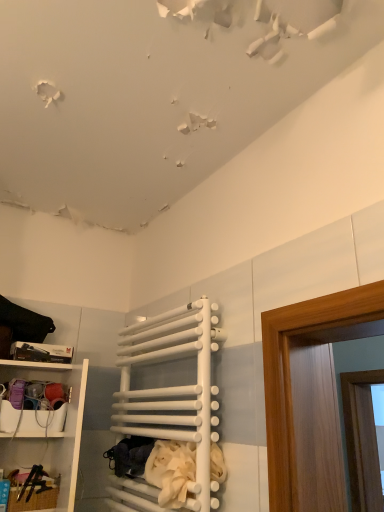
Image resolution: width=384 pixels, height=512 pixels. I want to click on white matte towel rack at center, so click(x=170, y=414).

Which object is further away from the camera taking this photo, beige fabric laundry at lower center or white matte towel rack at center?

beige fabric laundry at lower center is further away from the camera.

From the image's perspective, is beige fabric laundry at lower center over white matte towel rack at center?

No, from the image's perspective, beige fabric laundry at lower center is not on top of white matte towel rack at center.

Between point (167, 458) and point (191, 336), which one is positioned in front?

Point (167, 458)

Is beige fabric laundry at lower center to the right of white plastic shelf at lower left from the viewer's perspective?

Correct, you'll find beige fabric laundry at lower center to the right of white plastic shelf at lower left.

From the picture: From the image's perspective, is beige fabric laundry at lower center under white plastic shelf at lower left?

No.

Is beige fabric laundry at lower center looking in the opposite direction of white plastic shelf at lower left?

No.

This screenshot has width=384, height=512. I want to click on cabinet on the right side of white plastic shelf at lower left, so click(170, 414).

Does white matte towel rack at center come behind white plastic shelf at lower left?

No, white matte towel rack at center is closer to the viewer.

Does white matte towel rack at center have a smaller size compared to white plastic shelf at lower left?

Correct, white matte towel rack at center occupies less space than white plastic shelf at lower left.

Would you say white matte towel rack at center is inside or outside white plastic shelf at lower left?

white matte towel rack at center is spatially situated outside white plastic shelf at lower left.

Which object is thinner, white matte towel rack at center or beige fabric laundry at lower center?

white matte towel rack at center is thinner.

From the image's perspective, is white matte towel rack at center on beige fabric laundry at lower center?

Yes, from the image's perspective, white matte towel rack at center is on top of beige fabric laundry at lower center.

Is the surface of white plastic shelf at lower left in direct contact with beige fabric laundry at lower center?

No, white plastic shelf at lower left is not touching beige fabric laundry at lower center.

Is white plastic shelf at lower left bigger or smaller than beige fabric laundry at lower center?

Considering their sizes, white plastic shelf at lower left takes up more space than beige fabric laundry at lower center.

In order to click on laundry above the white plastic shelf at lower left (from the image's perspective) in this screenshot , I will do `click(164, 468)`.

From the image's perspective, is white plastic shelf at lower left below beige fabric laundry at lower center?

Yes, from the image's perspective, white plastic shelf at lower left is beneath beige fabric laundry at lower center.

In the scene shown: Which is more to the left, white plastic shelf at lower left or white matte towel rack at center?

white plastic shelf at lower left.

You are a GUI agent. You are given a task and a screenshot of the screen. Output one action in this format:
    pyautogui.click(x=<x>, y=<y>)
    Task: Click on the cabinet that is above the white plastic shelf at lower left (from the image's perspective)
    The width and height of the screenshot is (384, 512).
    Given the screenshot: What is the action you would take?
    pyautogui.click(x=170, y=414)

Does point (18, 462) lie in front of point (170, 436)?

No, it is behind (170, 436).

Is white plastic shelf at lower left in contact with white matte towel rack at center?

No, white plastic shelf at lower left is not in contact with white matte towel rack at center.

What are the coordinates of `laundry behind the white matte towel rack at center` in the screenshot? It's located at (164, 468).

I want to click on shelf below the beige fabric laundry at lower center (from the image's perspective), so click(x=49, y=432).

Looking at the image, which one is located further to white matte towel rack at center, white plastic shelf at lower left or beige fabric laundry at lower center?

white plastic shelf at lower left is positioned further to the anchor white matte towel rack at center.

Based on their spatial positions, is white matte towel rack at center or white plastic shelf at lower left further from beige fabric laundry at lower center?

The object further to beige fabric laundry at lower center is white plastic shelf at lower left.

Estimate the real-world distances between objects in this image. Which object is further from beige fabric laundry at lower center, white plastic shelf at lower left or white matte towel rack at center?

Among the two, white plastic shelf at lower left is located further to beige fabric laundry at lower center.

When comparing their distances from white plastic shelf at lower left, does beige fabric laundry at lower center or white matte towel rack at center seem closer?

white matte towel rack at center lies closer to white plastic shelf at lower left than the other object.

Based on their spatial positions, is beige fabric laundry at lower center or white plastic shelf at lower left closer to white matte towel rack at center?

beige fabric laundry at lower center is positioned closer to the anchor white matte towel rack at center.

Considering their positions, is white matte towel rack at center positioned further to white plastic shelf at lower left than beige fabric laundry at lower center?

Among the two, beige fabric laundry at lower center is located further to white plastic shelf at lower left.

This screenshot has height=512, width=384. I want to click on cabinet located between white plastic shelf at lower left and beige fabric laundry at lower center in the left-right direction, so click(x=170, y=414).